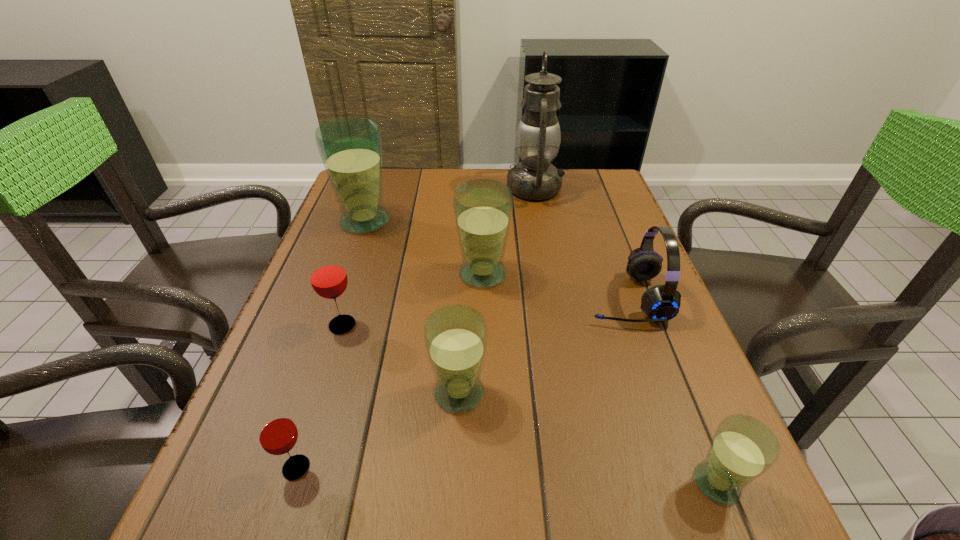
Locate an element on the screen. vacant space positioned 0.110m on the right of the third farthest blue glass is located at coordinates (546, 393).

Where is `vacant area situated on the right of the smaller red glass`? This screenshot has width=960, height=540. vacant area situated on the right of the smaller red glass is located at coordinates pyautogui.click(x=423, y=468).

You are a GUI agent. You are given a task and a screenshot of the screen. Output one action in this format:
    pyautogui.click(x=<x>, y=<y>)
    Task: Click on the free space located 0.300m on the left of the smallest blue glass
    This screenshot has height=540, width=960.
    Given the screenshot: What is the action you would take?
    pyautogui.click(x=502, y=483)

Where is `oil lamp that is at the far edge`? The height and width of the screenshot is (540, 960). oil lamp that is at the far edge is located at coordinates click(538, 136).

I want to click on glass that is positioned at the far edge, so click(350, 148).

Image resolution: width=960 pixels, height=540 pixels. Find the location of `object that is at the near edge`. object that is at the near edge is located at coordinates (743, 448).

Find the location of a particular element. This screenshot has height=540, width=960. headset present at the right edge is located at coordinates (660, 303).

This screenshot has height=540, width=960. Identify the location of glass at the right edge. (743, 448).

At what (x,y) coordinates should I click in order to perform the action: click on object that is at the far left corner. Please return your answer as a coordinate pair (x, y). Looking at the image, I should click on (350, 148).

At what (x,y) coordinates should I click in order to perform the action: click on object at the near right corner. Please return your answer as a coordinate pair (x, y). The image size is (960, 540). Looking at the image, I should click on (743, 448).